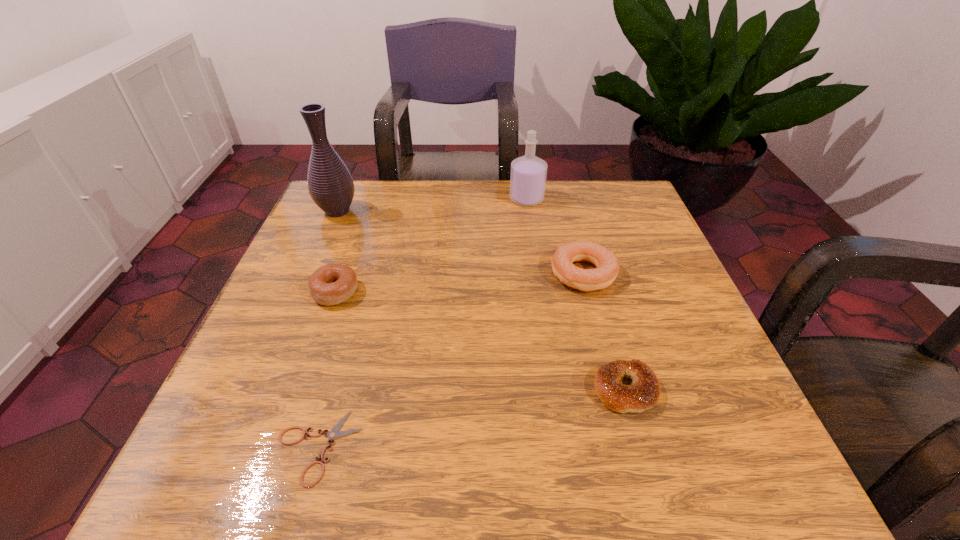
Image resolution: width=960 pixels, height=540 pixels. Identify the location of empty space that is in between the shears and the perfume. (422, 323).

The image size is (960, 540). I want to click on free space that is in between the tallest object and the second shortest object, so click(481, 300).

The width and height of the screenshot is (960, 540). In order to click on unoccupied area between the tallest object and the leftmost bagel in this screenshot , I will do `click(336, 251)`.

I want to click on free spot between the fifth shortest object and the shortest bagel, so click(x=576, y=294).

Where is `object identified as the fifth closest to the shortest object`? The image size is (960, 540). object identified as the fifth closest to the shortest object is located at coordinates (528, 174).

Identify which object is the fourth closest to the tallest object. Please provide its 2D coordinates. Your answer should be formatted as a tuple, i.e. [(x, y)], where the tuple contains the x and y coordinates of a point satisfying the conditions above.

[(334, 433)]

The width and height of the screenshot is (960, 540). Identify the location of the second closest bagel to the fifth tallest object. (331, 284).

This screenshot has height=540, width=960. I want to click on bagel that is the second closest to the fifth tallest object, so pos(331,284).

Locate an element on the screen. vacant area in the image that satisfies the following two spatial constraints: 1. on the front side of the shortest object; 2. on the left side of the vase is located at coordinates (236, 447).

Locate an element on the screen. The image size is (960, 540). free space that satisfies the following two spatial constraints: 1. on the front side of the fifth tallest object; 2. on the left side of the vase is located at coordinates (261, 389).